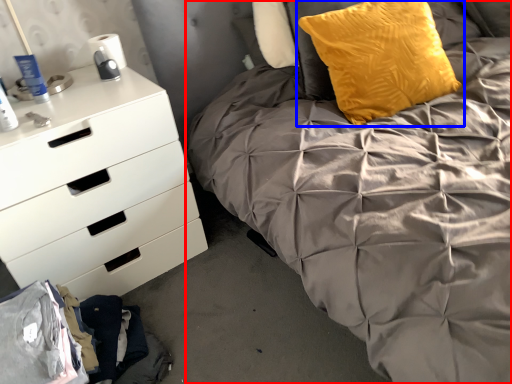
Question: Among these objects, which one is nearest to the camera, bed (highlighted by a red box) or pillow (highlighted by a blue box)?

Choices:
 (A) bed
 (B) pillow

Answer: (A)